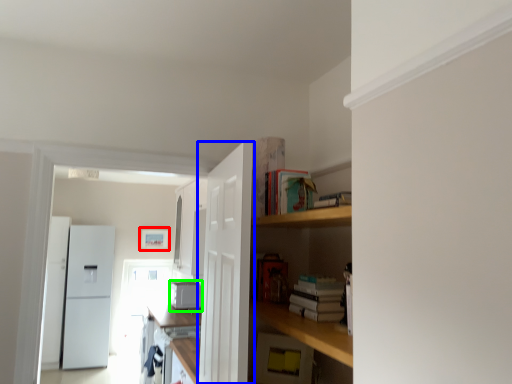
Question: Estimate the real-world distances between objects in this image. Which object is closer to picture frame (highlighted by a red box), door (highlighted by a blue box) or appliance (highlighted by a green box)?

Choices:
 (A) door
 (B) appliance

Answer: (B)